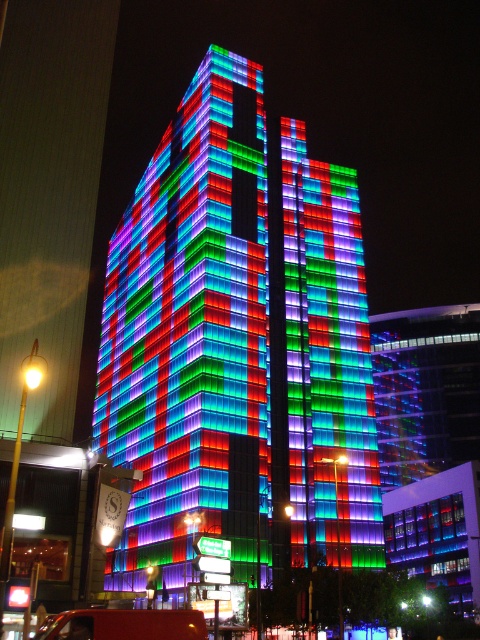
Question: Which point appears closest to the camera in this image?

Choices:
 (A) (350, 438)
 (B) (79, 616)

Answer: (B)

Question: Does multicolored glass building at center appear over metallic red truck at lower left?

Choices:
 (A) no
 (B) yes

Answer: (B)

Question: Which point is farther to the camera?

Choices:
 (A) metallic red truck at lower left
 (B) multicolored glass building at center

Answer: (B)

Question: Which point appears farthest from the camera in this image?

Choices:
 (A) (108, 266)
 (B) (153, 621)

Answer: (A)

Question: Is multicolored glass building at center above metallic red truck at lower left?

Choices:
 (A) yes
 (B) no

Answer: (A)

Question: Can you confirm if multicolored glass building at center is wider than metallic red truck at lower left?

Choices:
 (A) yes
 (B) no

Answer: (A)